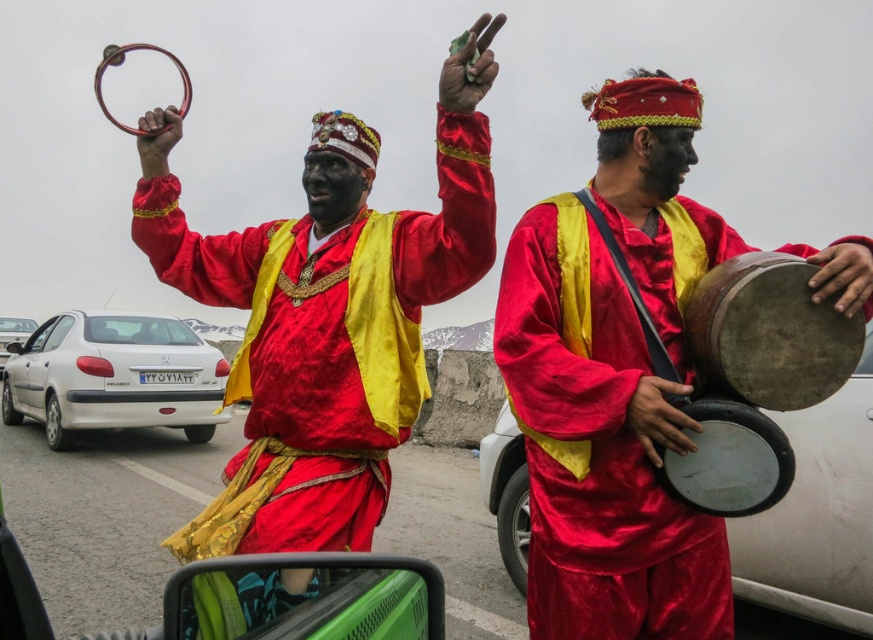
Looking at this image, is the position of satin red drum at right more distant than that of matte brown drum at right?

No, satin red drum at right is in front of matte brown drum at right.

Which is behind, point (674, 419) or point (703, 442)?

The point (703, 442) is more distant.

You are a GUI agent. You are given a task and a screenshot of the screen. Output one action in this format:
    pyautogui.click(x=<x>, y=<y>)
    Task: Click on the satin red drum at right
    This screenshot has width=873, height=640.
    Given the screenshot: What is the action you would take?
    pyautogui.click(x=614, y=381)

Can you confirm if satin red vest at upper center is taller than wooden drum at right?

Yes.

Between point (241, 232) and point (772, 387), which one is positioned in front?

Positioned in front is point (772, 387).

What do you see at coordinates (327, 316) in the screenshot? I see `satin red vest at upper center` at bounding box center [327, 316].

The image size is (873, 640). In order to click on satin red vest at upper center in this screenshot , I will do `click(327, 316)`.

Can you confirm if wooden drum at right is positioned below matte brown drum at right?

No, wooden drum at right is not below matte brown drum at right.

Who is lower down, wooden drum at right or matte brown drum at right?

matte brown drum at right

At what (x,y) coordinates should I click in order to perform the action: click on wooden drum at right. Please return your answer as a coordinate pair (x, y). Looking at the image, I should click on (768, 333).